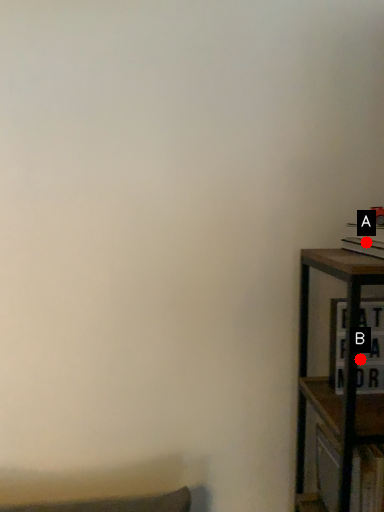
Question: Two points are circled on the image, labeled by A and B beside each circle. Which point is farther from the camera taking this photo?

Choices:
 (A) A is further
 (B) B is further

Answer: (B)